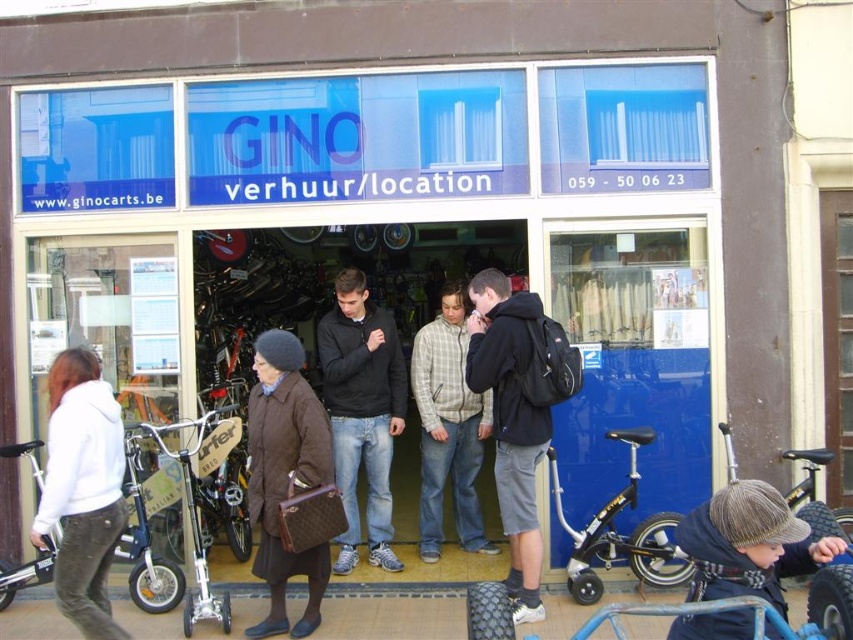
Does black matte jacket at center have a smaller size compared to light brown plaid shirt at center?

No.

Where is `black matte jacket at center`? This screenshot has width=853, height=640. black matte jacket at center is located at coordinates click(x=363, y=412).

Is point (770, 497) farther from viewer compared to point (498, 336)?

No, it is not.

Image resolution: width=853 pixels, height=640 pixels. Find the location of `rubber textured stroller at lower center`. rubber textured stroller at lower center is located at coordinates (735, 566).

Between point (495, 612) and point (479, 355), which one is positioned behind?

The point (479, 355) is more distant.

Identify the location of rubber textured stroller at lower center. (735, 566).

Does point (270, 545) come behind point (733, 534)?

Yes, point (270, 545) is farther from viewer.

Is brown quilted coat at center to the left of knitted woolen hat at lower right from the viewer's perspective?

Indeed, brown quilted coat at center is positioned on the left side of knitted woolen hat at lower right.

This screenshot has width=853, height=640. I want to click on brown quilted coat at center, so click(285, 476).